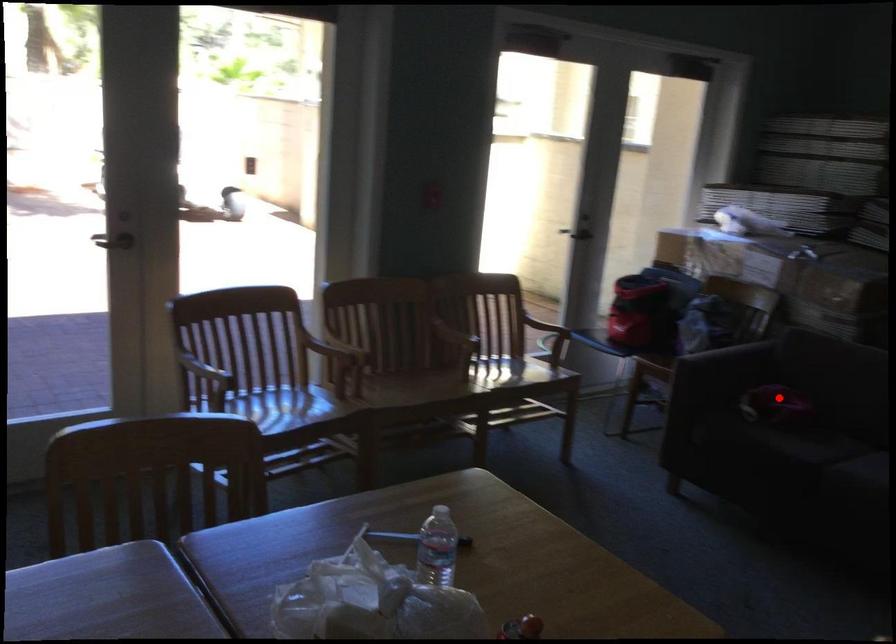
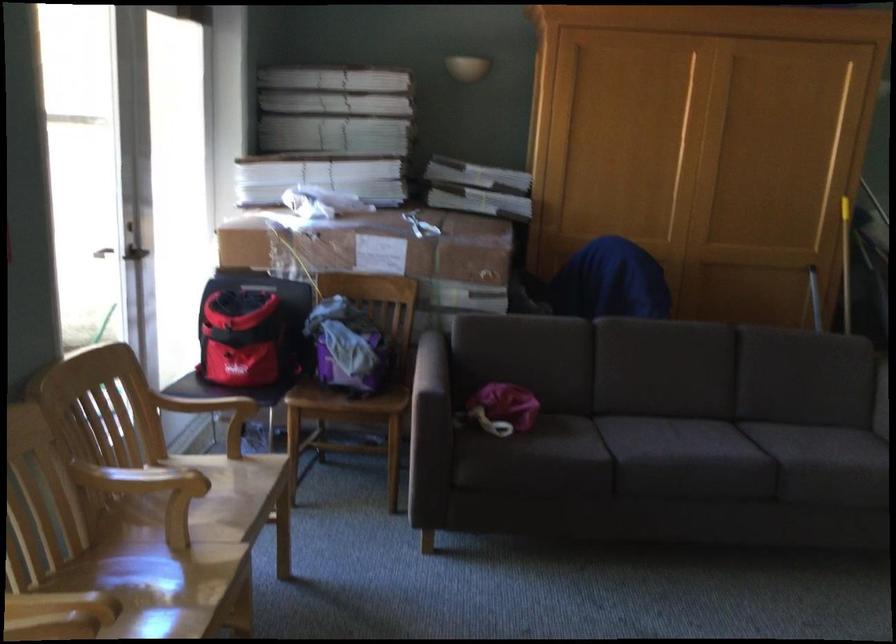
Question: I am providing you with two images of the same scene from different viewpoints. A red point is marked on the first image. Is the red point's position out of view in image 2?

Choices:
 (A) Yes
 (B) No

Answer: (B)